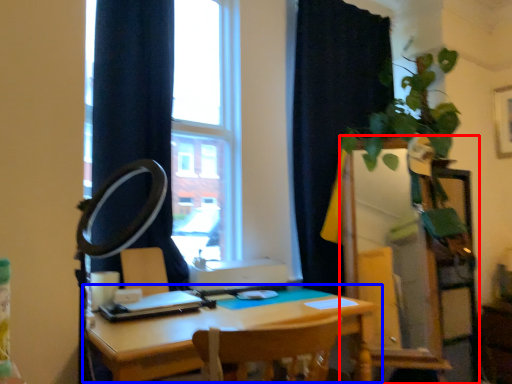
Question: Which object is closer to the camera taking this photo, dresser (highlighted by a red box) or table (highlighted by a blue box)?

Choices:
 (A) dresser
 (B) table

Answer: (B)